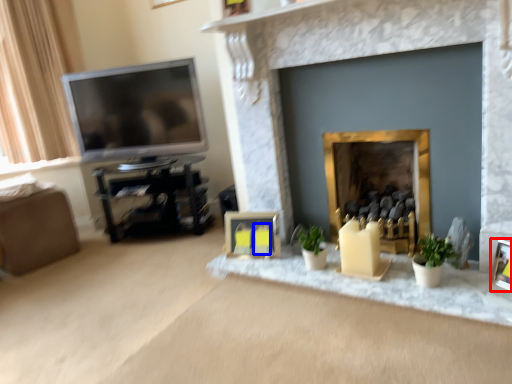
Question: Which point is closer to the camera, picture frame (highlighted by a red box) or candle (highlighted by a blue box)?

Choices:
 (A) picture frame
 (B) candle

Answer: (A)